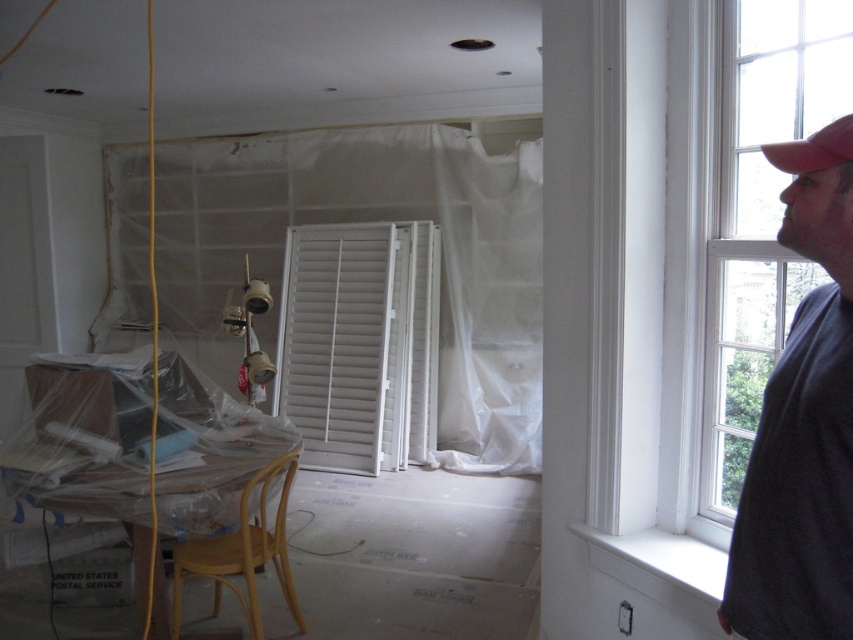
Question: Considering the relative positions of white matte shutters at center and red matte baseball cap at upper right in the image provided, where is white matte shutters at center located with respect to red matte baseball cap at upper right?

Choices:
 (A) left
 (B) right

Answer: (A)

Question: Which is farther from the white matte shutters at center?

Choices:
 (A) dark gray t-shirt at right
 (B) light brown wooden stool at lower left
 (C) white plastic curtain at center

Answer: (A)

Question: Which point is farther to the camera?

Choices:
 (A) red matte baseball cap at upper right
 (B) light brown wooden stool at lower left

Answer: (B)

Question: Can you confirm if white matte shutters at center is thinner than light brown wooden stool at lower left?

Choices:
 (A) yes
 (B) no

Answer: (B)

Question: Can you confirm if dark gray t-shirt at right is smaller than white plastic curtain at center?

Choices:
 (A) no
 (B) yes

Answer: (B)

Question: Considering the real-world distances, which object is farthest from the dark gray t-shirt at right?

Choices:
 (A) white plastic curtain at center
 (B) light brown wooden stool at lower left
 (C) red matte baseball cap at upper right

Answer: (A)